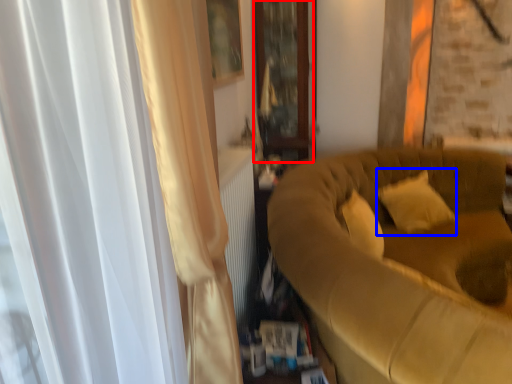
Question: Which object appears farthest to the camera in this image, glass door (highlighted by a red box) or pillow (highlighted by a blue box)?

Choices:
 (A) glass door
 (B) pillow

Answer: (A)